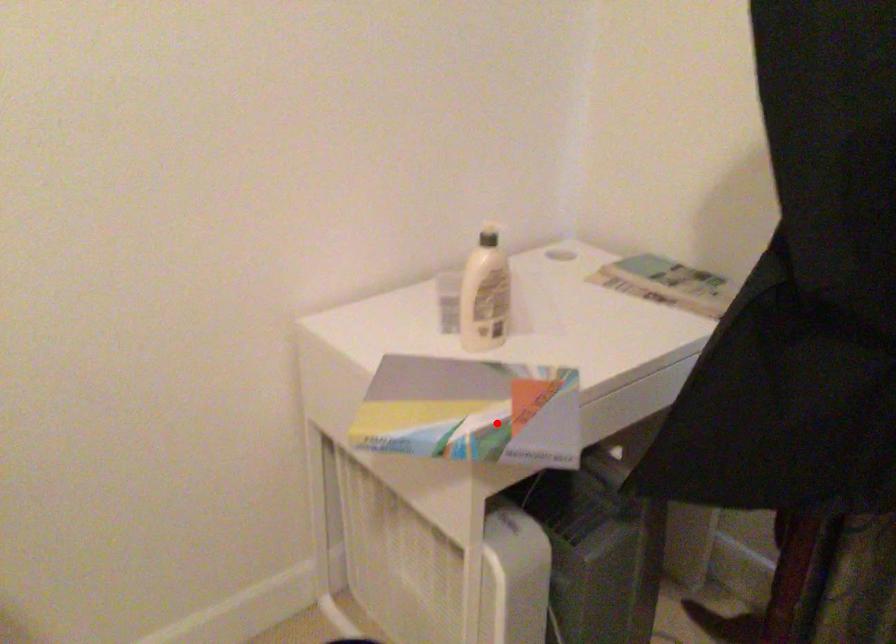
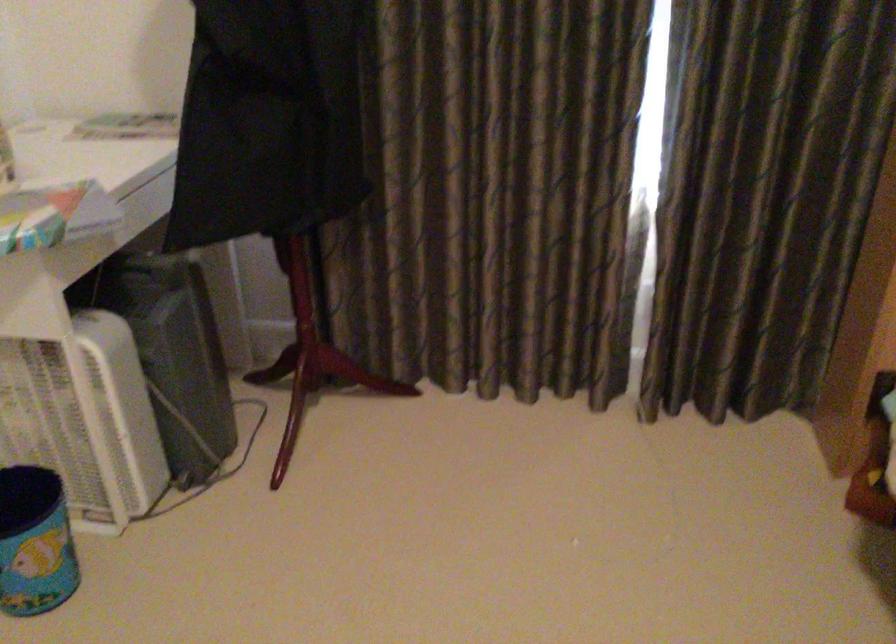
Locate, in the second image, the point that corresponds to the highlighted location in the first image.

(54, 214)